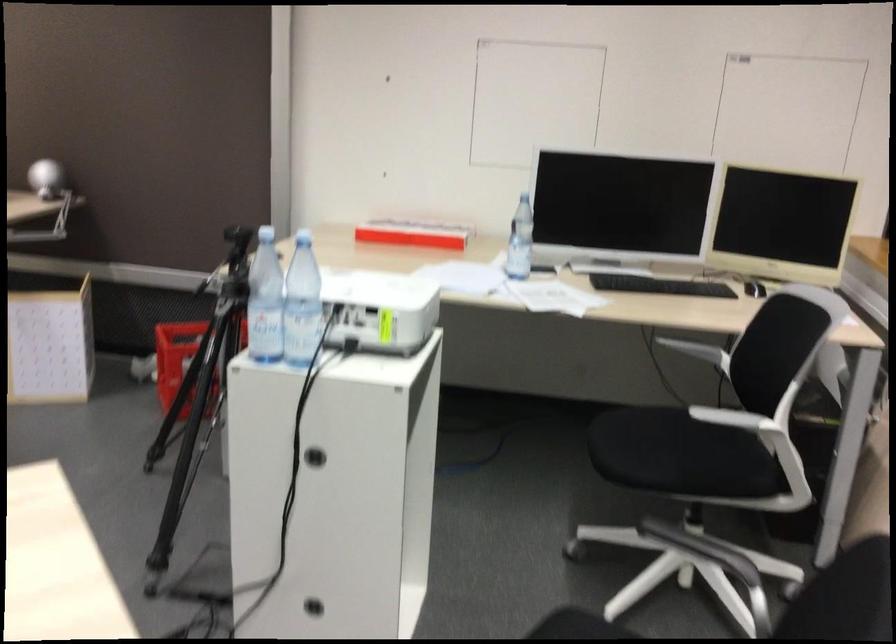
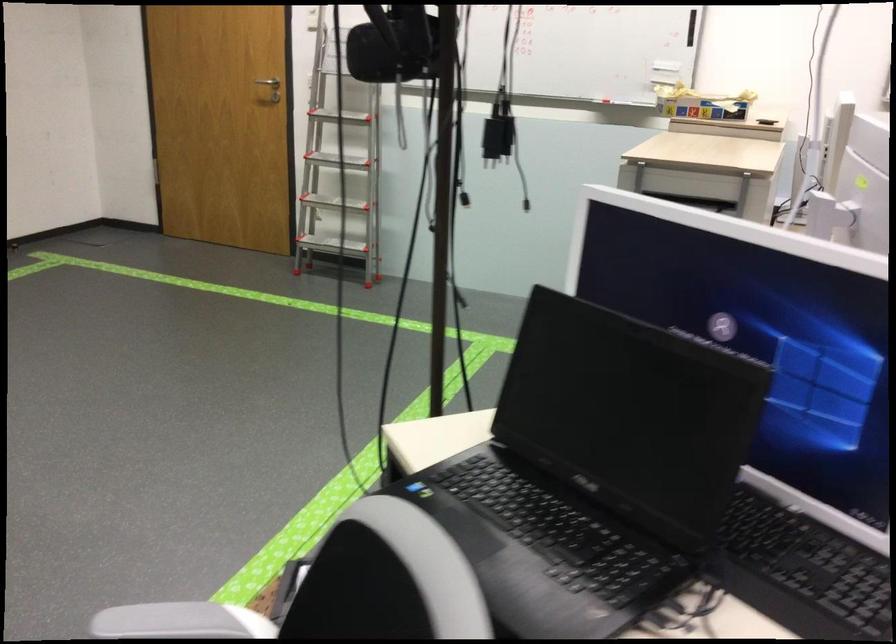
Based on the continuous images, in which direction is the camera rotating?

The camera rotated toward left-down.